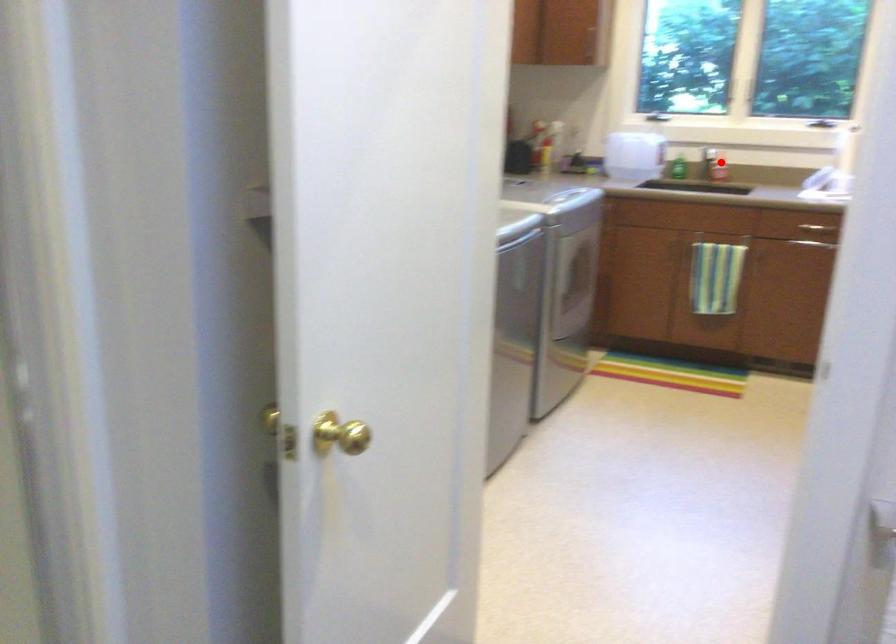
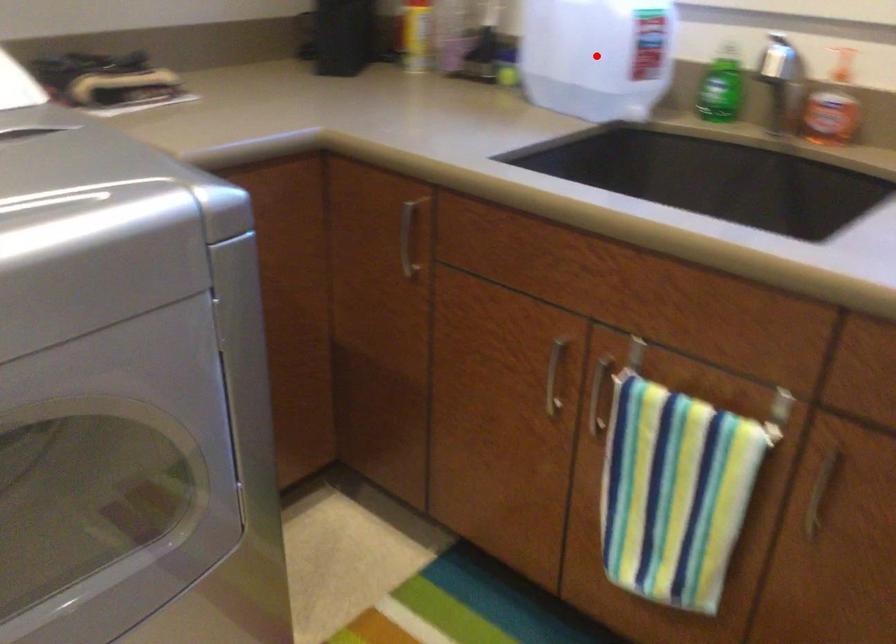
I am providing you with two images of the same scene from different viewpoints. A red point is marked on the first image and another point is marked on the second image. Do the highlighted points in image1 and image2 indicate the same real-world spot?

No